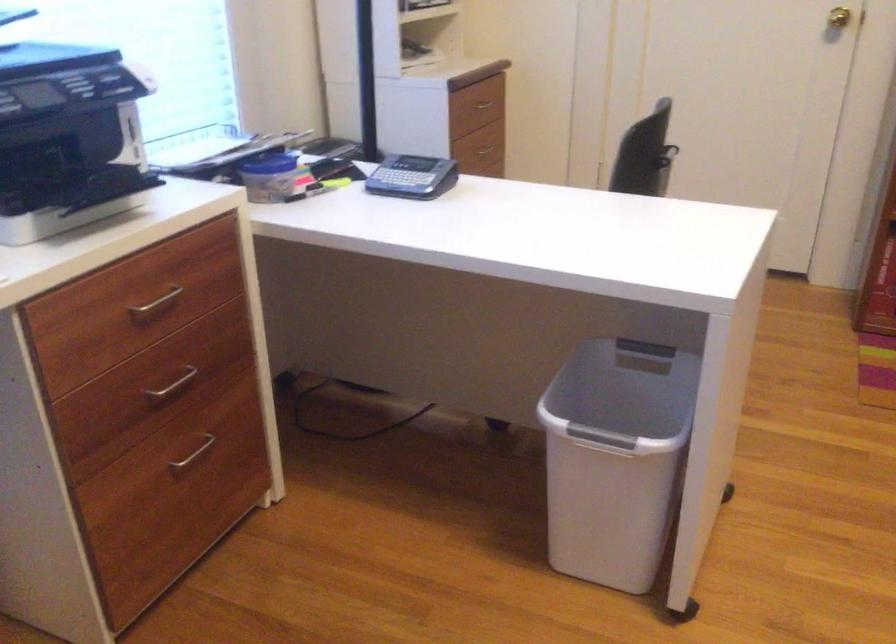
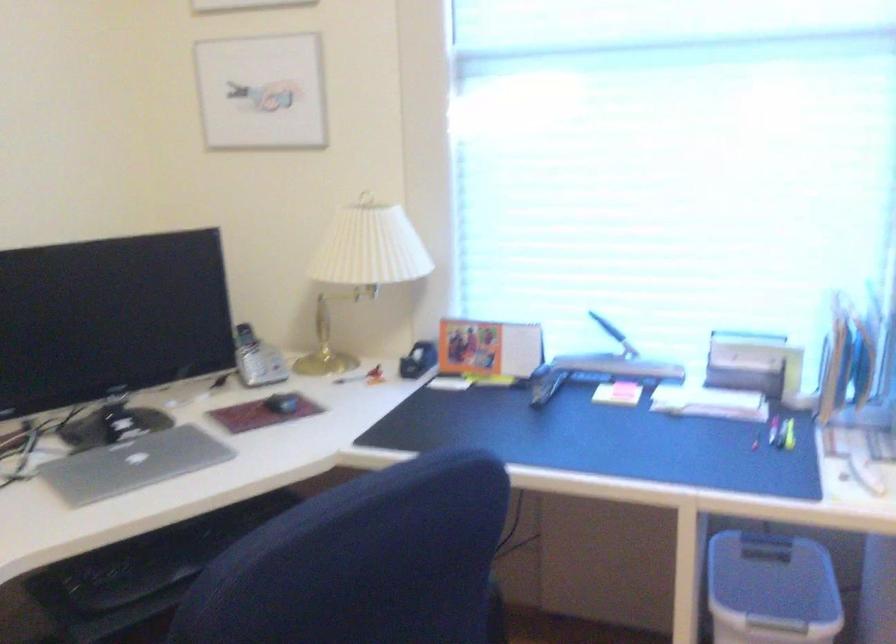
Question: How did the camera likely rotate?

Choices:
 (A) Left
 (B) Right
 (C) Up
 (D) Down

Answer: (A)